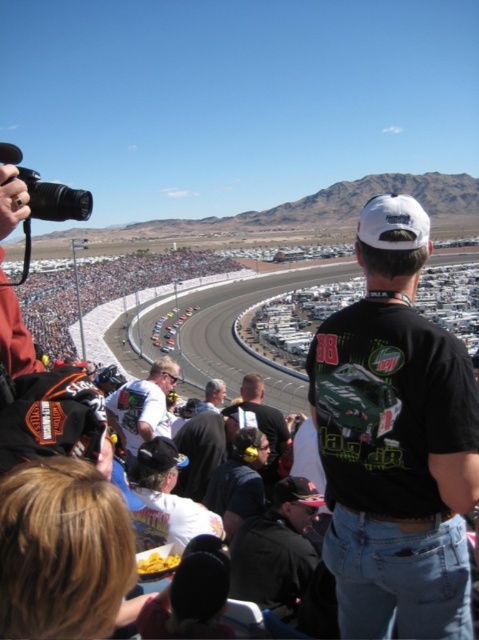
You are a photographer at the motorsport event. You need to capture a photo that includes both the black leather jacket at lower center and the white matte shirt at center. Based on their positions, which one should you adjust your camera angle to focus on first to ensure both are in frame?

The black leather jacket at lower center is positioned on the right side of white matte shirt at center. To include both in the frame, you should first focus on the white matte shirt at center and then adjust the angle to include the black leather jacket at lower center on the right side.

You are a photographer at the motorsport event. You want to take a photo that includes both the black leather jacket at lower center and the matte black helmet at center. Which object should you focus on first to ensure both are in sharp focus?

The black leather jacket at lower center is closer to the viewer than the matte black helmet at center. To ensure both are in sharp focus, you should focus on the matte black helmet at center first, as focusing on the farther object allows the closer object to be within the depth of field.

You are a photographer at the NASCAR event. You want to take a photo that includes both the point at coordinates point (380, 556) and point (71, 284). Which point should you focus on first to ensure both are in focus?

You should focus on point (380, 556) first because it is closer to the camera than point (71, 284), ensuring both points are within the depth of field.